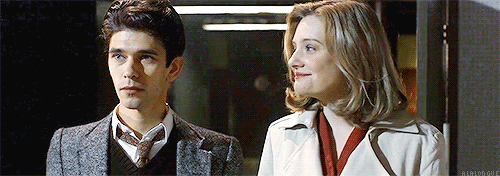
At what (x,y) coordinates should I click in order to perform the action: click on fluorescent lights. Please return your answer as a coordinate pair (x, y). Looking at the image, I should click on (266, 10), (259, 26).